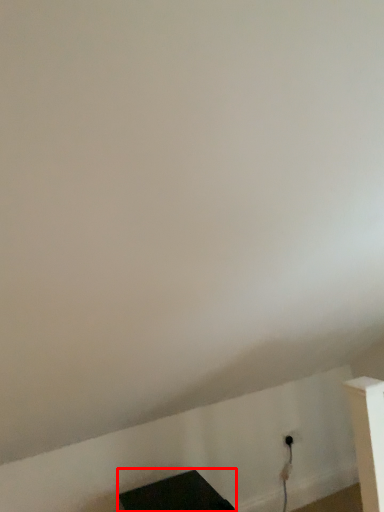
Question: Observing the image, what is the correct spatial positioning of furniture (annotated by the red box) in reference to electric outlet?

Choices:
 (A) right
 (B) left

Answer: (B)